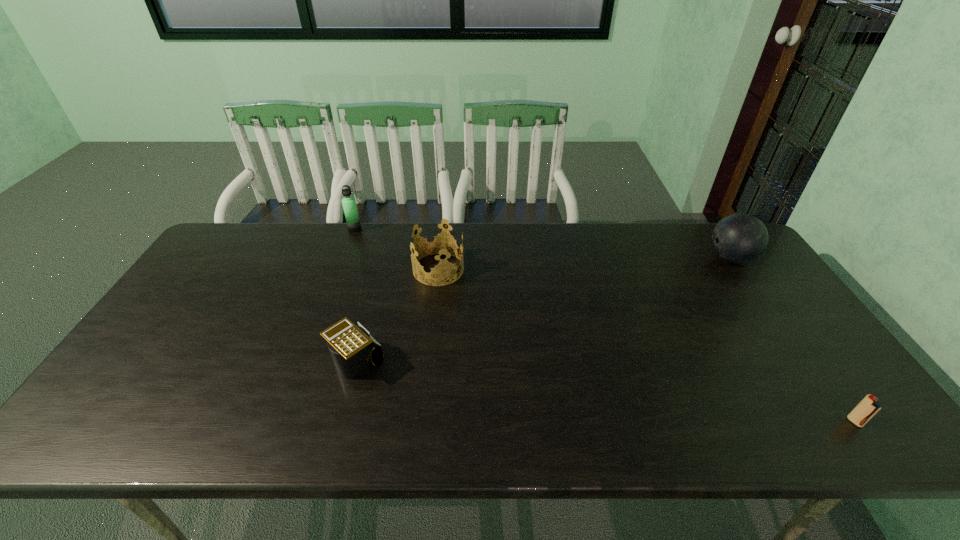
Locate an element on the screen. igniter situated at the right edge is located at coordinates (868, 407).

What are the coordinates of `object that is at the far right corner` in the screenshot? It's located at (739, 238).

Locate an element on the screen. The height and width of the screenshot is (540, 960). object at the near right corner is located at coordinates (868, 407).

The width and height of the screenshot is (960, 540). Identify the location of vacant position at the far edge of the desktop. tap(371, 226).

Find the location of a particular element. The width and height of the screenshot is (960, 540). free region at the near edge of the desktop is located at coordinates (633, 430).

Identify the location of free space at the left edge of the desktop. The height and width of the screenshot is (540, 960). (205, 284).

This screenshot has height=540, width=960. Find the location of `free region at the right edge of the desktop`. free region at the right edge of the desktop is located at coordinates (823, 400).

Where is `vacant space at the far left corner of the desktop`? The height and width of the screenshot is (540, 960). vacant space at the far left corner of the desktop is located at coordinates point(252,233).

At what (x,y) coordinates should I click in order to perform the action: click on vacant space at the far right corner of the desktop. Please return your answer as a coordinate pair (x, y). Image resolution: width=960 pixels, height=540 pixels. Looking at the image, I should click on [x=697, y=228].

Where is `blank region between the second nearest object and the leftmost object`? blank region between the second nearest object and the leftmost object is located at coordinates (355, 295).